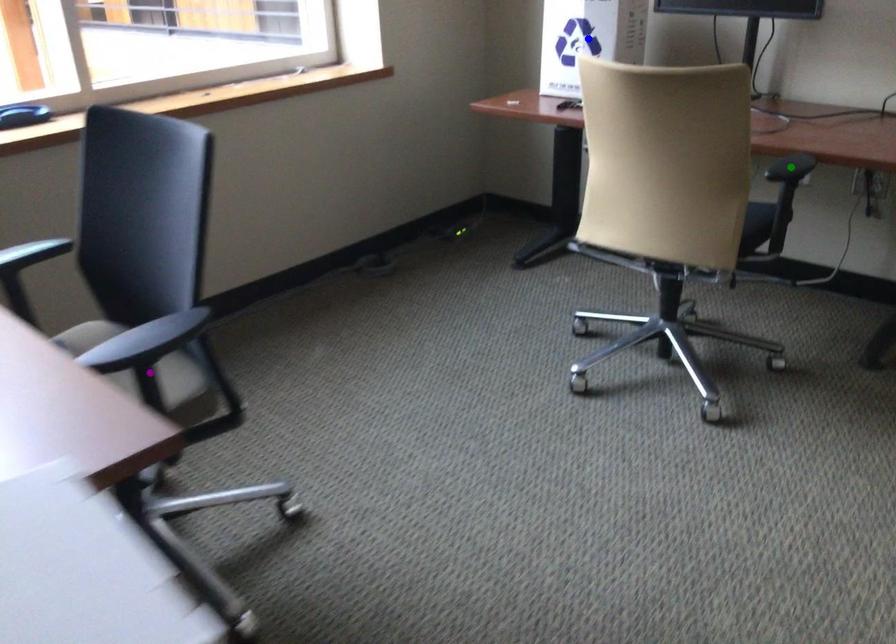
Order these from nearest to farthest:
1. blue point
2. green point
3. purple point

purple point < green point < blue point